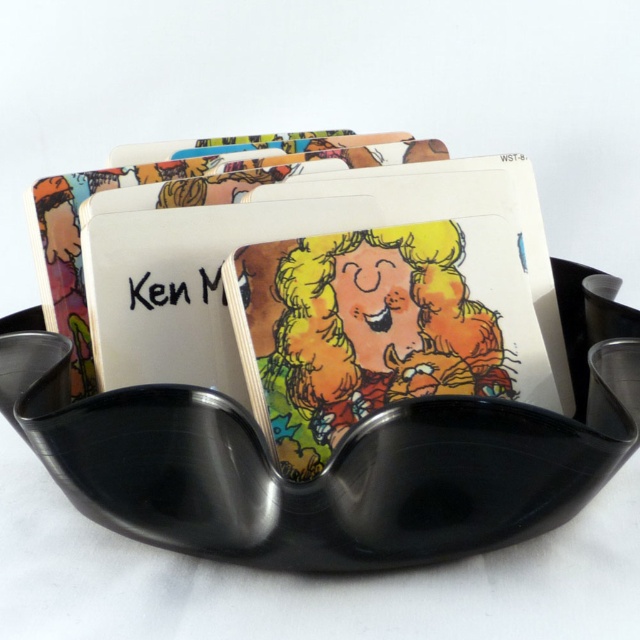
This screenshot has width=640, height=640. What do you see at coordinates (333, 296) in the screenshot?
I see `matte cardboard card at center` at bounding box center [333, 296].

Which of these two, matte cardboard card at center or cartoon paper card at center, stands taller?

With more height is matte cardboard card at center.

Is point (506, 275) farther from camera compared to point (344, 154)?

That is False.

At what (x,y) coordinates should I click in order to perform the action: click on matte cardboard card at center. Please return your answer as a coordinate pair (x, y). Looking at the image, I should click on (333, 296).